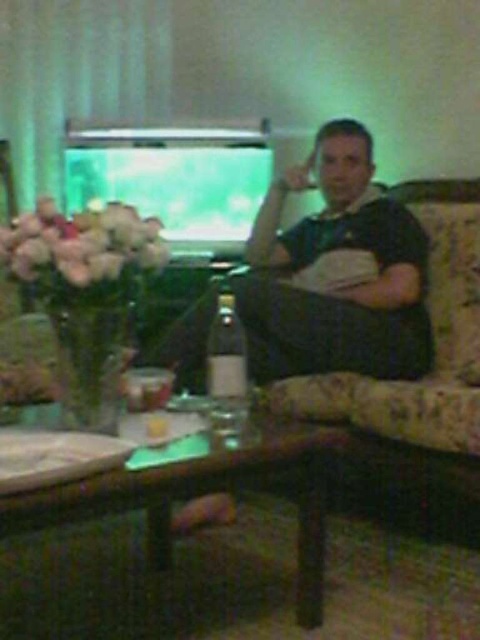
Does dark green jersey at center have a lesser width compared to floral-patterned fabric couch at right?

Yes.

Does dark green jersey at center have a greater width compared to floral-patterned fabric couch at right?

No, dark green jersey at center is not wider than floral-patterned fabric couch at right.

Is point (290, 336) positioned before point (432, 317)?

Yes, point (290, 336) is closer to viewer.

Image resolution: width=480 pixels, height=640 pixels. In order to click on dark green jersey at center in this screenshot , I will do `click(342, 285)`.